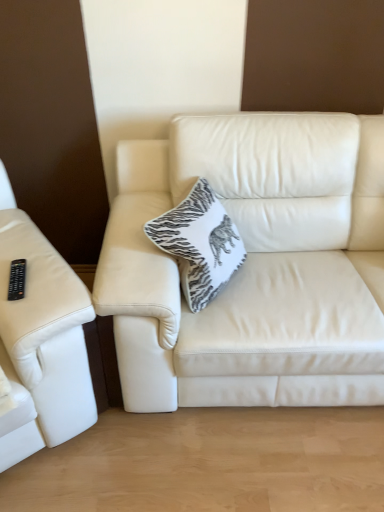
Question: Is black plastic remote at left located within white leather couch at center, the 1th studio couch from the right?

Choices:
 (A) yes
 (B) no

Answer: (B)

Question: Is white leather couch at center, the second studio couch when ordered from left to right, wider than black plastic remote at left?

Choices:
 (A) no
 (B) yes

Answer: (B)

Question: From the image's perspective, would you say white leather couch at center, the 1th studio couch from the right, is shown under black plastic remote at left?

Choices:
 (A) no
 (B) yes

Answer: (A)

Question: Can you confirm if white leather couch at center, the 1th studio couch from the right, is shorter than black plastic remote at left?

Choices:
 (A) yes
 (B) no

Answer: (B)

Question: Can you confirm if white leather couch at center, the 1th studio couch from the right, is bigger than black plastic remote at left?

Choices:
 (A) no
 (B) yes

Answer: (B)

Question: In terms of height, does white leather couch at center, the 1th studio couch from the right, look taller or shorter compared to white textured cushion at center?

Choices:
 (A) tall
 (B) short

Answer: (A)

Question: From a real-world perspective, is white leather couch at center, the 1th studio couch from the right, above or below white textured cushion at center?

Choices:
 (A) below
 (B) above

Answer: (A)

Question: Is white leather couch at center, the 1th studio couch from the right, inside the boundaries of white textured cushion at center, or outside?

Choices:
 (A) inside
 (B) outside

Answer: (B)

Question: Considering their positions, is white leather couch at center, the 1th studio couch from the right, located in front of or behind white textured cushion at center?

Choices:
 (A) front
 (B) behind

Answer: (A)

Question: Is white textured cushion at center bigger or smaller than white leather couch at center, the second studio couch when ordered from left to right?

Choices:
 (A) big
 (B) small

Answer: (B)

Question: Is point (196, 287) positioned closer to the camera than point (122, 325)?

Choices:
 (A) farther
 (B) closer

Answer: (A)

Question: Do you think white textured cushion at center is within white leather couch at center, the second studio couch when ordered from left to right, or outside of it?

Choices:
 (A) inside
 (B) outside

Answer: (A)

Question: Visually, is white textured cushion at center positioned to the left or to the right of white leather couch at center, the 1th studio couch from the right?

Choices:
 (A) right
 (B) left

Answer: (B)

Question: Is white textured cushion at center taller or shorter than leather couch at left, arranged as the first studio couch when viewed from the left?

Choices:
 (A) tall
 (B) short

Answer: (B)

Question: Would you say white textured cushion at center is inside or outside leather couch at left, which is the second studio couch from right to left?

Choices:
 (A) inside
 (B) outside

Answer: (B)